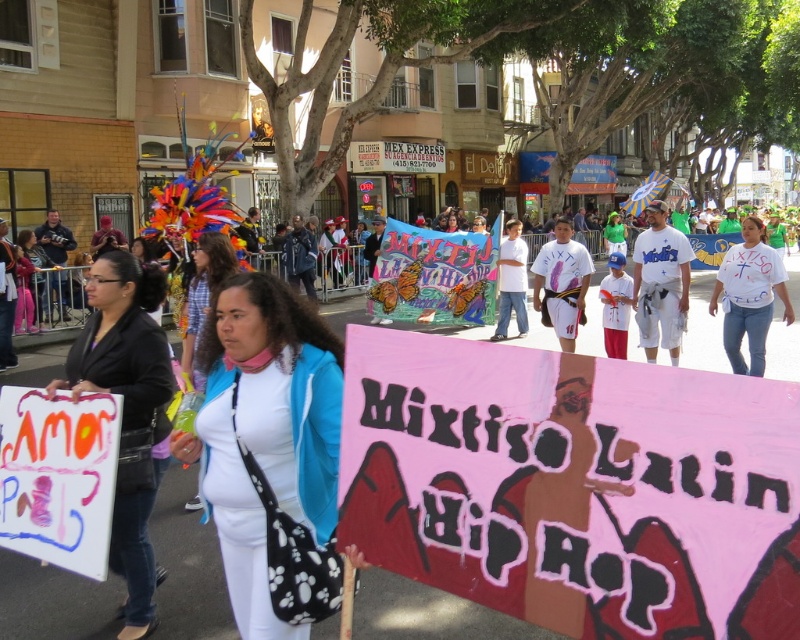
Does matte black jacket at center have a larger size compared to white fabric at center?

No, matte black jacket at center is not bigger than white fabric at center.

Where is `matte black jacket at center`? Image resolution: width=800 pixels, height=640 pixels. matte black jacket at center is located at coordinates (128, 410).

Does white matte jacket at center appear on the right side of white t-shirt at center?

Incorrect, white matte jacket at center is not on the right side of white t-shirt at center.

From the picture: Between white matte jacket at center and white t-shirt at center, which one appears on the left side from the viewer's perspective?

Positioned to the left is white matte jacket at center.

The width and height of the screenshot is (800, 640). Describe the element at coordinates (266, 433) in the screenshot. I see `white matte jacket at center` at that location.

At what (x,y) coordinates should I click in order to perform the action: click on white matte jacket at center. Please return your answer as a coordinate pair (x, y). Looking at the image, I should click on (266, 433).

Image resolution: width=800 pixels, height=640 pixels. What are the coordinates of `white matte jacket at center` in the screenshot? It's located at (266, 433).

Find the location of a particular element. The width and height of the screenshot is (800, 640). white matte jacket at center is located at coordinates (266, 433).